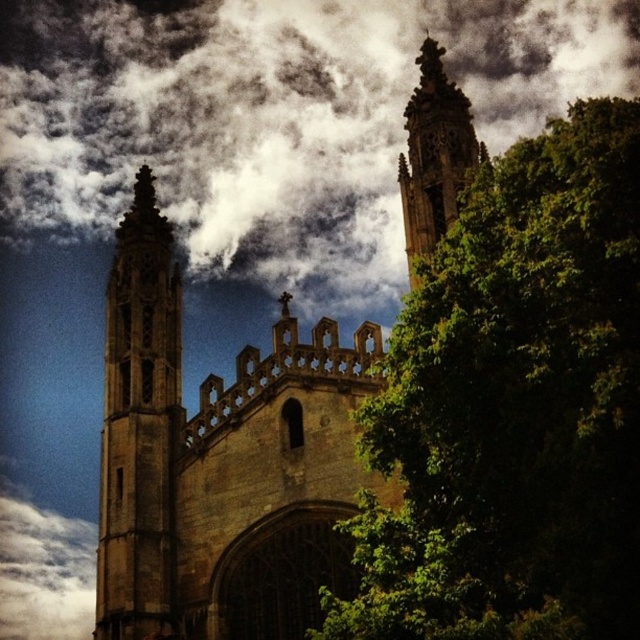
Does green leafy tree at right have a lesser height compared to brown stone tower at left?

In fact, green leafy tree at right may be taller than brown stone tower at left.

Consider the image. Who is taller, green leafy tree at right or brown stone tower at left?

green leafy tree at right is taller.

What are the coordinates of `green leafy tree at right` in the screenshot? It's located at (513, 406).

Describe the element at coordinates (513, 406) in the screenshot. I see `green leafy tree at right` at that location.

Who is shorter, green leafy tree at right or brown stone tower at upper center?

brown stone tower at upper center

Is point (532, 476) positioned in front of point (456, 116)?

Yes.

At what (x,y) coordinates should I click in order to perform the action: click on green leafy tree at right. Please return your answer as a coordinate pair (x, y). Looking at the image, I should click on (513, 406).

Which of these two, white fluffy cloud at upper center or brown stone tower at upper center, stands shorter?

brown stone tower at upper center

Does white fluffy cloud at upper center appear over brown stone tower at upper center?

Indeed, white fluffy cloud at upper center is positioned over brown stone tower at upper center.

Does point (522, 76) come closer to viewer compared to point (406, 104)?

No, it is not.

This screenshot has width=640, height=640. What are the coordinates of `white fluffy cloud at upper center` in the screenshot? It's located at (273, 120).